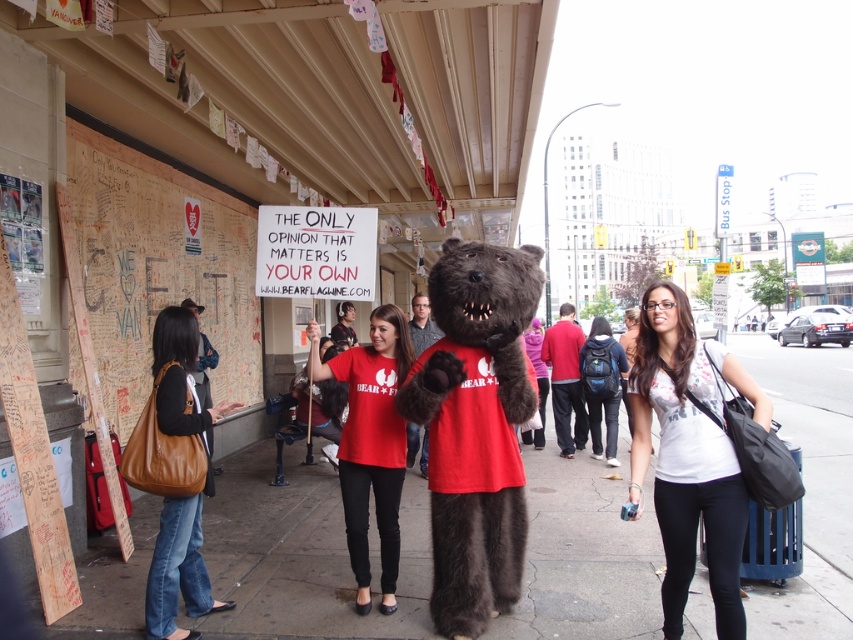
You are a delivery person carrying a large package that requires a flat surface to place. You see the concrete sidewalk at center and the fuzzy brown bear at center. Which surface would be more suitable for placing your package?

The concrete sidewalk at center is bigger than the fuzzy brown bear at center, so the concrete sidewalk at center is more suitable for placing your large package as it provides a larger and flatter surface area.

You are standing at the center of the scene and want to move to the wooden wall at left. Which direction should you face to walk directly towards it?

Since the wooden wall at left is located at point (163, 276), you should face towards the left direction to walk directly towards it.